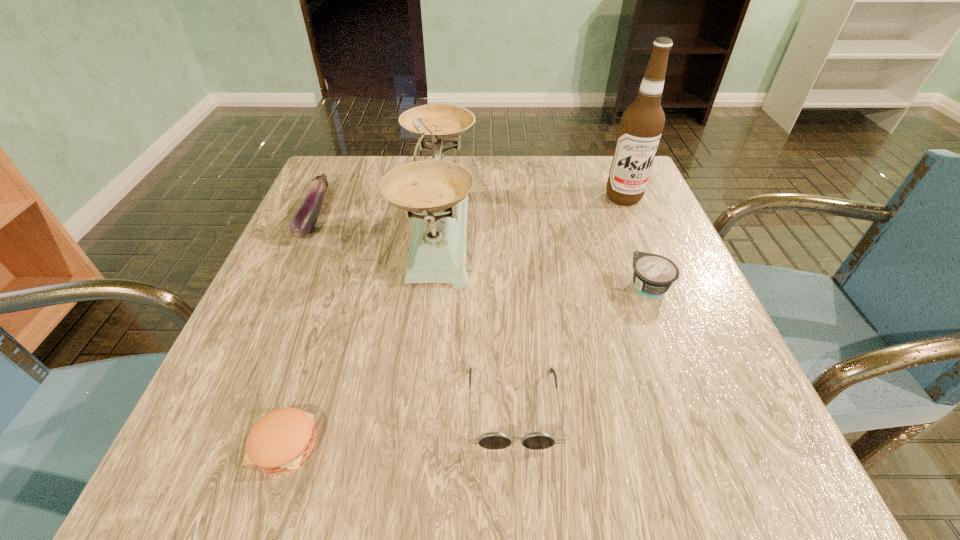
Find the location of `yogurt that is at the right edge`. yogurt that is at the right edge is located at coordinates (653, 275).

Where is `object at the far left corner`? This screenshot has height=540, width=960. object at the far left corner is located at coordinates (304, 220).

The image size is (960, 540). I want to click on object that is at the near left corner, so click(281, 440).

Where is `object that is at the far right corner`? object that is at the far right corner is located at coordinates (642, 123).

Where is `blank space at the far edge`? This screenshot has width=960, height=540. blank space at the far edge is located at coordinates (499, 171).

Identify the location of free space at the near edge of the desktop. (573, 429).

This screenshot has width=960, height=540. In the image, there is a desktop. Identify the location of vacant space at the left edge. (294, 272).

At what (x,y) coordinates should I click in order to perform the action: click on vacant space at the right edge of the desktop. Please return your answer as a coordinate pair (x, y). Looking at the image, I should click on (625, 229).

The image size is (960, 540). I want to click on vacant space at the far left corner, so click(x=352, y=159).

In order to click on free location at the near left corner of the desktop in this screenshot , I will do `click(247, 427)`.